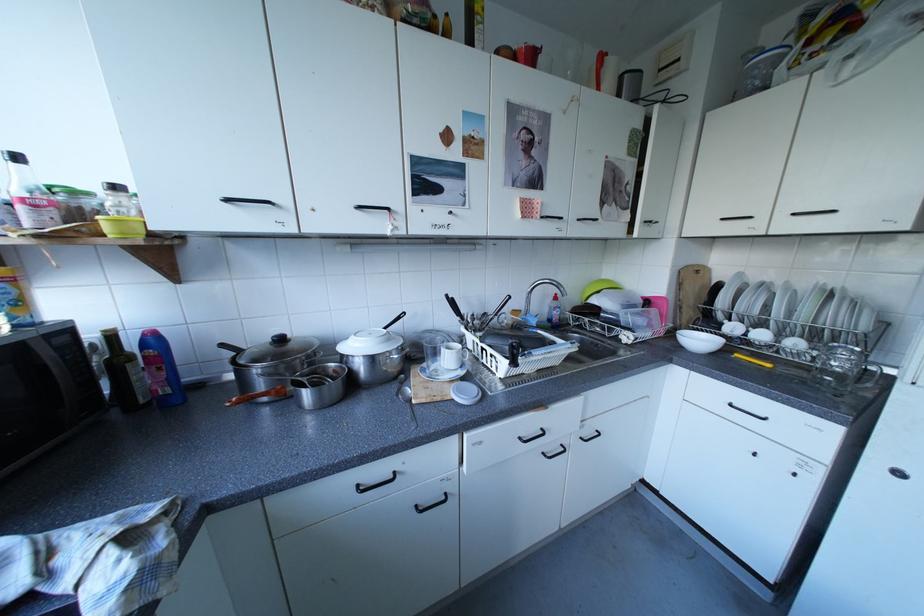
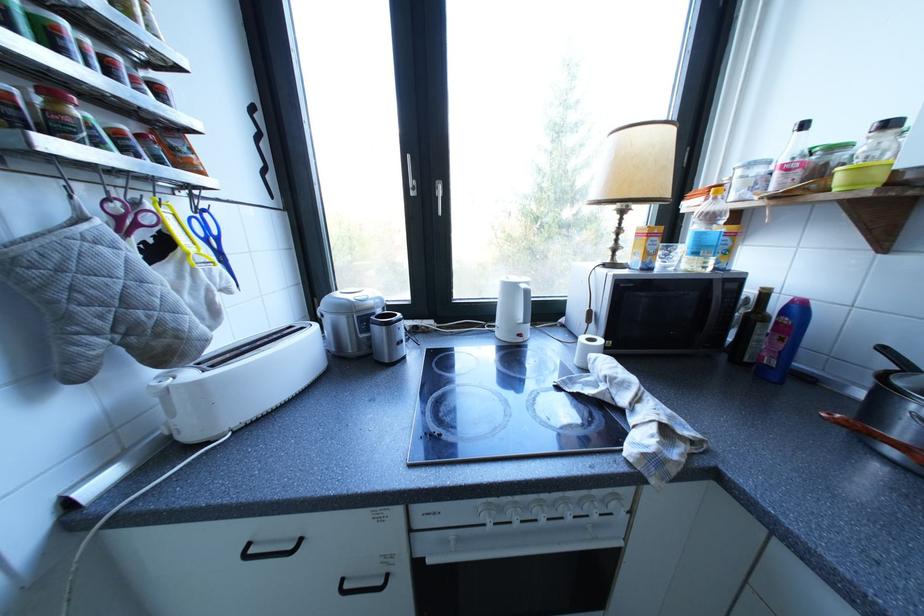
Locate, in the second image, the point that corresponds to [120,362] in the first image.

(760, 315)